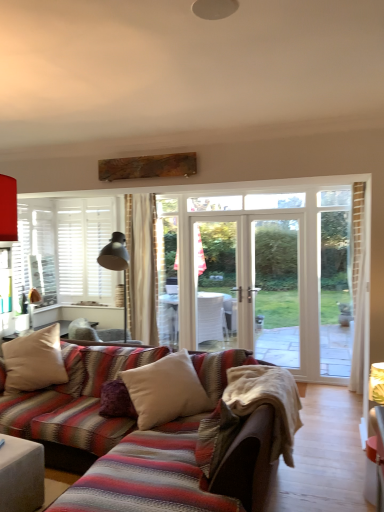
Question: Is matte gray ottoman at lower left in front of beige cotton blanket at lower center?

Choices:
 (A) no
 (B) yes

Answer: (B)

Question: Considering the relative sizes of matte gray ottoman at lower left and beige cotton blanket at lower center in the image provided, is matte gray ottoman at lower left bigger than beige cotton blanket at lower center?

Choices:
 (A) no
 (B) yes

Answer: (A)

Question: Considering the relative sizes of matte gray ottoman at lower left and beige cotton blanket at lower center in the image provided, is matte gray ottoman at lower left thinner than beige cotton blanket at lower center?

Choices:
 (A) no
 (B) yes

Answer: (B)

Question: Considering the relative positions of matte gray ottoman at lower left and beige cotton blanket at lower center in the image provided, is matte gray ottoman at lower left to the left of beige cotton blanket at lower center from the viewer's perspective?

Choices:
 (A) yes
 (B) no

Answer: (A)

Question: Is matte gray ottoman at lower left further to camera compared to beige cotton blanket at lower center?

Choices:
 (A) yes
 (B) no

Answer: (B)

Question: Visually, is beige fabric pillow at lower left, the third pillow from the right, positioned to the left or to the right of beige cotton blanket at lower center?

Choices:
 (A) left
 (B) right

Answer: (A)

Question: Looking at the image, does beige fabric pillow at lower left, the third pillow from the right, seem bigger or smaller compared to beige cotton blanket at lower center?

Choices:
 (A) big
 (B) small

Answer: (A)

Question: From the image's perspective, is beige fabric pillow at lower left, the third pillow from the right, positioned above or below beige cotton blanket at lower center?

Choices:
 (A) above
 (B) below

Answer: (A)

Question: From a real-world perspective, is beige fabric pillow at lower left, the third pillow from the right, positioned above or below beige cotton blanket at lower center?

Choices:
 (A) above
 (B) below

Answer: (A)

Question: Looking at their shapes, would you say velvet purple pillow at center, positioned as the second pillow in right-to-left order, is wider or thinner than beige cotton blanket at lower center?

Choices:
 (A) thin
 (B) wide

Answer: (A)

Question: From the image's perspective, is velvet purple pillow at center, the second pillow when ordered from left to right, located above or below beige cotton blanket at lower center?

Choices:
 (A) below
 (B) above

Answer: (A)

Question: Is velvet purple pillow at center, positioned as the second pillow in right-to-left order, bigger or smaller than beige cotton blanket at lower center?

Choices:
 (A) small
 (B) big

Answer: (A)

Question: From a real-world perspective, is velvet purple pillow at center, the second pillow when ordered from left to right, positioned above or below beige cotton blanket at lower center?

Choices:
 (A) above
 (B) below

Answer: (B)

Question: Based on their positions, is matte gray ottoman at lower left located to the left or right of white soft cushion at center, which ranks as the first pillow in right-to-left order?

Choices:
 (A) left
 (B) right

Answer: (A)

Question: From a real-world perspective, relative to white soft cushion at center, which ranks as the first pillow in right-to-left order, is matte gray ottoman at lower left vertically above or below?

Choices:
 (A) below
 (B) above

Answer: (A)